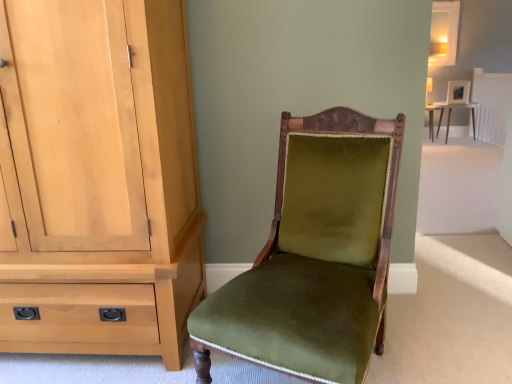
Question: From a real-world perspective, does matte white table at upper right stand above light wood cabinet at left?

Choices:
 (A) no
 (B) yes

Answer: (A)

Question: Are matte white table at upper right and light wood cabinet at left beside each other?

Choices:
 (A) no
 (B) yes

Answer: (A)

Question: Does matte white table at upper right turn towards light wood cabinet at left?

Choices:
 (A) yes
 (B) no

Answer: (B)

Question: Is matte white table at upper right shorter than light wood cabinet at left?

Choices:
 (A) no
 (B) yes

Answer: (B)

Question: Considering the relative positions of matte white table at upper right and light wood cabinet at left in the image provided, is matte white table at upper right in front of light wood cabinet at left?

Choices:
 (A) no
 (B) yes

Answer: (A)

Question: Considering the positions of point (186, 102) and point (429, 124), is point (186, 102) closer or farther from the camera than point (429, 124)?

Choices:
 (A) farther
 (B) closer

Answer: (B)

Question: From the image's perspective, is light wood cabinet at left located above or below matte white table at upper right?

Choices:
 (A) above
 (B) below

Answer: (B)

Question: Is light wood cabinet at left in front of or behind matte white table at upper right in the image?

Choices:
 (A) behind
 (B) front

Answer: (B)

Question: From their relative heights in the image, would you say light wood cabinet at left is taller or shorter than matte white table at upper right?

Choices:
 (A) short
 (B) tall

Answer: (B)

Question: In the image, is matte white table at upper right positioned in front of or behind light wood cabinet at left?

Choices:
 (A) front
 (B) behind

Answer: (B)

Question: Considering the positions of matte white table at upper right and light wood cabinet at left in the image, is matte white table at upper right bigger or smaller than light wood cabinet at left?

Choices:
 (A) small
 (B) big

Answer: (A)

Question: Is matte white table at upper right inside the boundaries of light wood cabinet at left, or outside?

Choices:
 (A) inside
 (B) outside

Answer: (B)

Question: From the image's perspective, is matte white table at upper right located above or below light wood cabinet at left?

Choices:
 (A) above
 (B) below

Answer: (A)

Question: In the image, is light wood cabinet at left positioned in front of or behind velvet-green chair at center?

Choices:
 (A) behind
 (B) front

Answer: (A)

Question: Considering the relative positions of light wood cabinet at left and velvet-green chair at center in the image provided, is light wood cabinet at left to the left or to the right of velvet-green chair at center?

Choices:
 (A) left
 (B) right

Answer: (A)